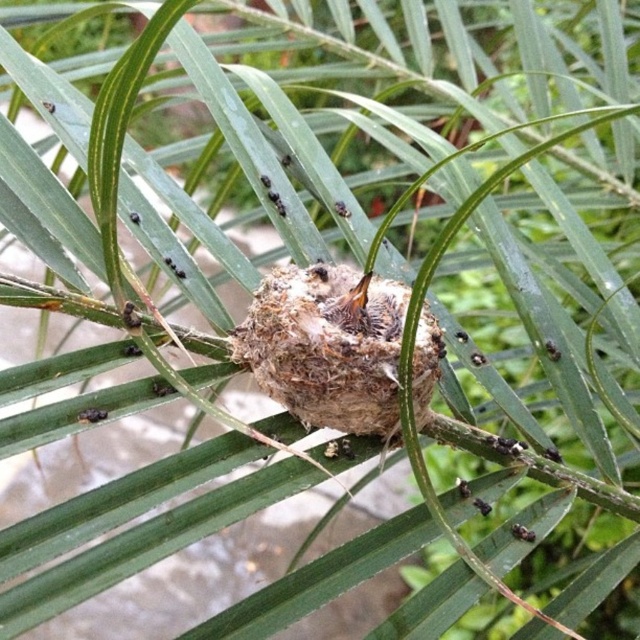
Is point (524, 540) positioned after point (483, 502)?

No, (524, 540) is closer to viewer.

Does black glossy ant at center have a greater height compared to black matte ant at center?

No.

Does point (522, 538) lie in front of point (488, 513)?

Yes, it is.

You are a GUI agent. You are given a task and a screenshot of the screen. Output one action in this format:
    pyautogui.click(x=<x>, y=<y>)
    Task: Click on the black glossy ant at center
    The width and height of the screenshot is (640, 640).
    Given the screenshot: What is the action you would take?
    pyautogui.click(x=522, y=532)

Measure the distance from brown fuzzy nest at center to black glossy ant at center.

brown fuzzy nest at center is 15.74 inches away from black glossy ant at center.

The image size is (640, 640). I want to click on brown fuzzy nest at center, so click(326, 346).

Consider the image. Which of these two, brown fuzzy nest at center or black matte ant at center, stands shorter?

With less height is black matte ant at center.

Which is in front, point (284, 307) or point (472, 504)?

Point (284, 307) is in front.

Locate an element on the screen. brown fuzzy nest at center is located at coordinates (326, 346).